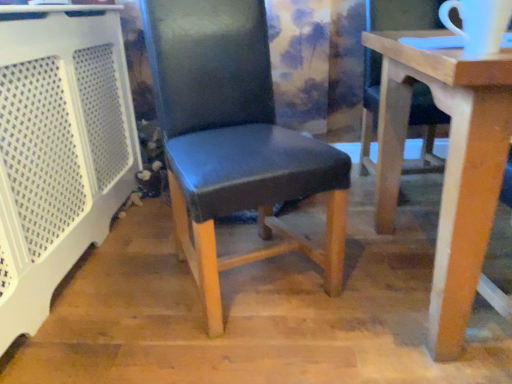
This screenshot has width=512, height=384. Describe the element at coordinates (58, 149) in the screenshot. I see `white perforated plastic at left` at that location.

What are the coordinates of `white perforated plastic at left` in the screenshot? It's located at (58, 149).

The image size is (512, 384). Find the location of `matte black chair at center, the second chair when ordered from left to right`. matte black chair at center, the second chair when ordered from left to right is located at coordinates (389, 131).

Considering the relative positions of matte black chair at center, the second chair when ordered from left to right, and white perforated plastic at left in the image provided, is matte black chair at center, the second chair when ordered from left to right, behind white perforated plastic at left?

No, matte black chair at center, the second chair when ordered from left to right, is closer to the viewer.

Is matte black chair at center, acting as the first chair starting from the right, bigger or smaller than white perforated plastic at left?

matte black chair at center, acting as the first chair starting from the right, is bigger than white perforated plastic at left.

From the image's perspective, is matte black chair at center, the second chair when ordered from left to right, above or below white perforated plastic at left?

matte black chair at center, the second chair when ordered from left to right, is situated lower than white perforated plastic at left in the image.

What's the angular difference between matte black chair at center, the second chair when ordered from left to right, and white perforated plastic at left's facing directions?

The angular difference between matte black chair at center, the second chair when ordered from left to right, and white perforated plastic at left is 89.6 degrees.

Based on the photo, which is in front, black leather chair at center, marked as the first chair in a left-to-right arrangement, or matte black chair at center, acting as the first chair starting from the right?

matte black chair at center, acting as the first chair starting from the right, is more forward.

Can you confirm if black leather chair at center, placed as the second chair when sorted from right to left, is taller than matte black chair at center, acting as the first chair starting from the right?

Indeed, black leather chair at center, placed as the second chair when sorted from right to left, has a greater height compared to matte black chair at center, acting as the first chair starting from the right.

Could you measure the distance between black leather chair at center, placed as the second chair when sorted from right to left, and matte black chair at center, the second chair when ordered from left to right?

black leather chair at center, placed as the second chair when sorted from right to left, and matte black chair at center, the second chair when ordered from left to right, are 38.90 inches apart.

From a real-world perspective, between black leather chair at center, marked as the first chair in a left-to-right arrangement, and matte black chair at center, acting as the first chair starting from the right, who is vertically higher?

black leather chair at center, marked as the first chair in a left-to-right arrangement, from a real-world perspective.

Is white perforated plastic at left taller or shorter than matte black chair at center, the second chair when ordered from left to right?

Considering their sizes, white perforated plastic at left has more height than matte black chair at center, the second chair when ordered from left to right.

This screenshot has height=384, width=512. What are the coordinates of `chair directly beneath the white perforated plastic at left (from a real-world perspective)` in the screenshot? It's located at (389, 131).

In the image, is white perforated plastic at left on the left side or the right side of matte black chair at center, acting as the first chair starting from the right?

Based on their positions, white perforated plastic at left is located to the left of matte black chair at center, acting as the first chair starting from the right.

Considering the sizes of black leather chair at center, placed as the second chair when sorted from right to left, and white perforated plastic at left in the image, is black leather chair at center, placed as the second chair when sorted from right to left, taller or shorter than white perforated plastic at left?

In the image, black leather chair at center, placed as the second chair when sorted from right to left, appears to be taller than white perforated plastic at left.

Considering the positions of objects black leather chair at center, marked as the first chair in a left-to-right arrangement, and white perforated plastic at left in the image provided, who is more to the right, black leather chair at center, marked as the first chair in a left-to-right arrangement, or white perforated plastic at left?

From the viewer's perspective, black leather chair at center, marked as the first chair in a left-to-right arrangement, appears more on the right side.

Consider the image. Which point is more distant from viewer, [148,16] or [91,110]?

The point [91,110] is behind.

Does white perforated plastic at left have a lesser height compared to black leather chair at center, placed as the second chair when sorted from right to left?

Correct, white perforated plastic at left is not as tall as black leather chair at center, placed as the second chair when sorted from right to left.

From the image's perspective, between white perforated plastic at left and black leather chair at center, marked as the first chair in a left-to-right arrangement, who is located below?

black leather chair at center, marked as the first chair in a left-to-right arrangement, appears lower in the image.

Which is more to the right, white perforated plastic at left or black leather chair at center, placed as the second chair when sorted from right to left?

From the viewer's perspective, black leather chair at center, placed as the second chair when sorted from right to left, appears more on the right side.

Is matte black chair at center, acting as the first chair starting from the right, wider or thinner than black leather chair at center, placed as the second chair when sorted from right to left?

Clearly, matte black chair at center, acting as the first chair starting from the right, has more width compared to black leather chair at center, placed as the second chair when sorted from right to left.

From the image's perspective, between matte black chair at center, acting as the first chair starting from the right, and black leather chair at center, marked as the first chair in a left-to-right arrangement, which one is located above?

black leather chair at center, marked as the first chair in a left-to-right arrangement, from the image's perspective.

In terms of height, does matte black chair at center, acting as the first chair starting from the right, look taller or shorter compared to black leather chair at center, marked as the first chair in a left-to-right arrangement?

Considering their sizes, matte black chair at center, acting as the first chair starting from the right, has less height than black leather chair at center, marked as the first chair in a left-to-right arrangement.

From the picture: Is matte black chair at center, acting as the first chair starting from the right, with black leather chair at center, placed as the second chair when sorted from right to left?

They are not placed beside each other.

Image resolution: width=512 pixels, height=384 pixels. What are the coordinates of `the 2nd chair counting from the right of the white perforated plastic at left` in the screenshot? It's located at (389, 131).

The width and height of the screenshot is (512, 384). What are the coordinates of `chair that appears below the black leather chair at center, placed as the second chair when sorted from right to left (from a real-world perspective)` in the screenshot? It's located at (389, 131).

Estimate the real-world distances between objects in this image. Which object is closer to matte black chair at center, the second chair when ordered from left to right, white perforated plastic at left or black leather chair at center, placed as the second chair when sorted from right to left?

black leather chair at center, placed as the second chair when sorted from right to left.

Estimate the real-world distances between objects in this image. Which object is further from white perforated plastic at left, black leather chair at center, marked as the first chair in a left-to-right arrangement, or matte black chair at center, acting as the first chair starting from the right?

Among the two, matte black chair at center, acting as the first chair starting from the right, is located further to white perforated plastic at left.

When comparing their distances from black leather chair at center, placed as the second chair when sorted from right to left, does white perforated plastic at left or matte black chair at center, acting as the first chair starting from the right, seem further?

matte black chair at center, acting as the first chair starting from the right.

Estimate the real-world distances between objects in this image. Which object is closer to black leather chair at center, placed as the second chair when sorted from right to left, matte black chair at center, acting as the first chair starting from the right, or white perforated plastic at left?

white perforated plastic at left is closer to black leather chair at center, placed as the second chair when sorted from right to left.

Considering their positions, is matte black chair at center, acting as the first chair starting from the right, positioned closer to white perforated plastic at left than black leather chair at center, marked as the first chair in a left-to-right arrangement?

black leather chair at center, marked as the first chair in a left-to-right arrangement, lies closer to white perforated plastic at left than the other object.

Estimate the real-world distances between objects in this image. Which object is closer to matte black chair at center, the second chair when ordered from left to right, black leather chair at center, placed as the second chair when sorted from right to left, or white perforated plastic at left?

black leather chair at center, placed as the second chair when sorted from right to left, is positioned closer to the anchor matte black chair at center, the second chair when ordered from left to right.

The height and width of the screenshot is (384, 512). Identify the location of chair between white perforated plastic at left and matte black chair at center, acting as the first chair starting from the right. (233, 139).